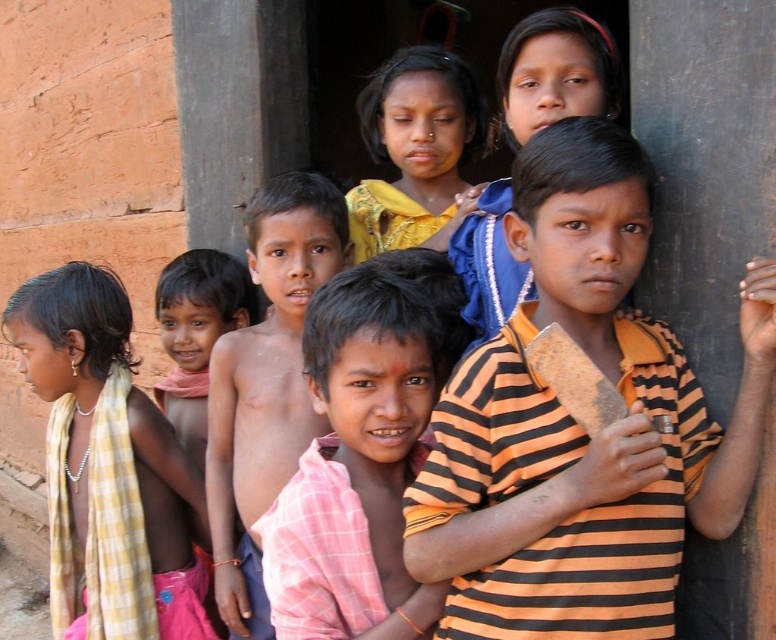
You are a photographer trying to take a portrait of the shiny skin boy at center without the yellow checkered cloth at left blocking his face. Is this possible based on their positions?

The yellow checkered cloth at left is further to the viewer than the shiny skin boy at center, so the cloth is closer to you and might block the boy. To avoid blocking, move the cloth or position yourself so the cloth is out of the shot.

You are standing in front of the rustic building and see the yellow checkered cloth at left and the shiny skin boy at center. Which object is positioned more to the left?

The yellow checkered cloth at left is positioned more to the left than the shiny skin boy at center.

You are a photographer setting up for a group photo. You have to position yourself between the orange striped shirt at center and the yellow checkered cloth at left. The camera requires a minimum of 1.5 meters to focus properly. Can you position yourself within the required distance?

The distance between the orange striped shirt at center and the yellow checkered cloth at left is 1.54 meters, which is just over the minimum requirement of 1.5 meters. Therefore, you can position yourself within the required distance.